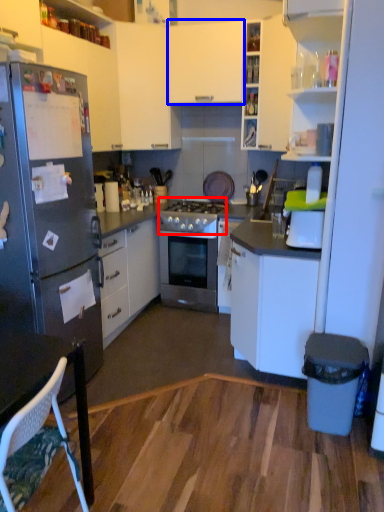
Question: Which object is further to the camera taking this photo, gas stove (highlighted by a red box) or cabinetry (highlighted by a blue box)?

Choices:
 (A) gas stove
 (B) cabinetry

Answer: (A)